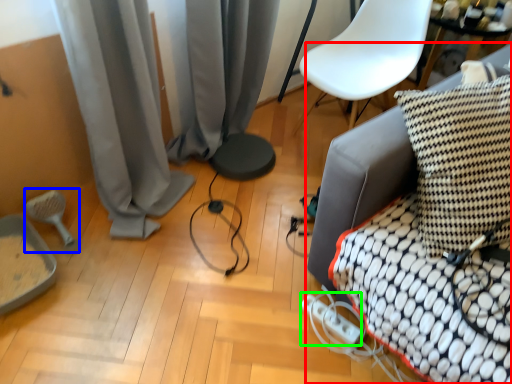
Question: Which is farther away from furniture (highlighted by a red box)? brush (highlighted by a blue box) or extension cord (highlighted by a green box)?

Choices:
 (A) brush
 (B) extension cord

Answer: (A)